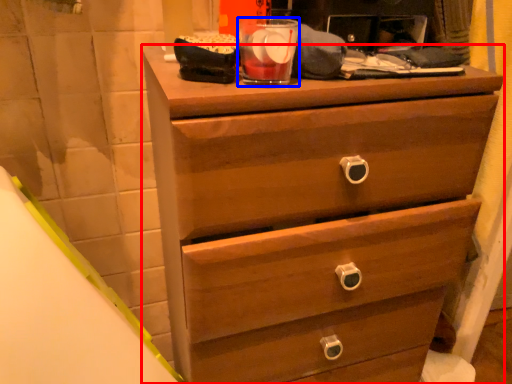
Question: Which point is closer to the camera, chest of drawers (highlighted by a red box) or beverage (highlighted by a blue box)?

Choices:
 (A) chest of drawers
 (B) beverage

Answer: (A)